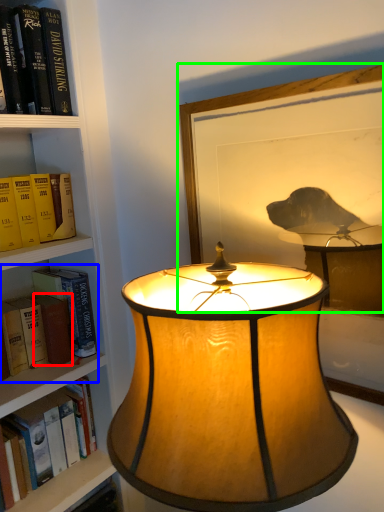
Question: Based on their relative distances, which object is nearer to paperback book (highlighted by a red box)? Choose from book (highlighted by a blue box) and picture frame (highlighted by a green box).

Choices:
 (A) book
 (B) picture frame

Answer: (A)